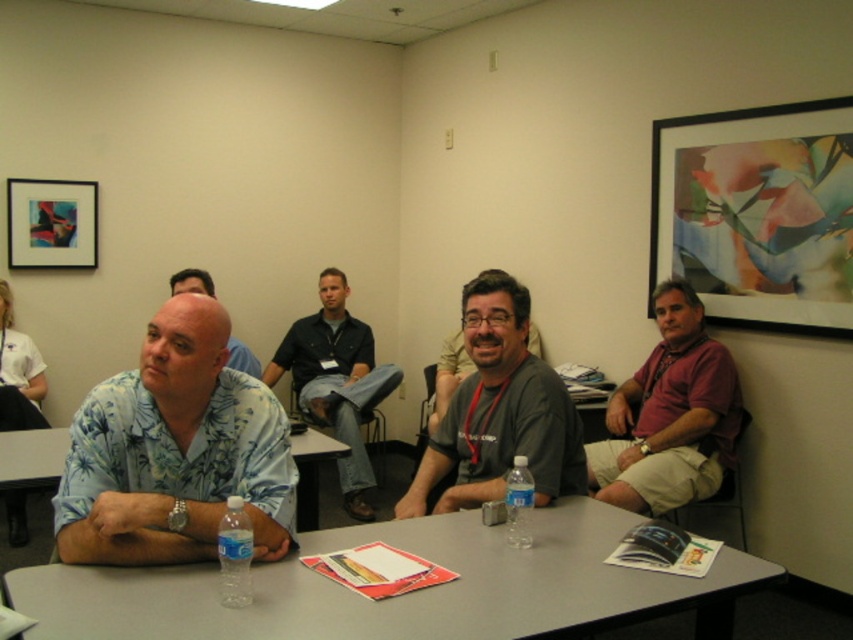
You are standing in the conference room and want to walk towards the two points marked in the image. Which point, point (16, 244) or point (45, 484), will you reach first?

You will reach point (16, 244) first because it is closer to you than point (45, 484), which is further away.

You are observing a group of people in a conference room. You notice the blue floral shirt at left and the gray fabric shirt at center. Which of these two shirts is positioned lower in the image?

The blue floral shirt at left is positioned lower in the image because it is below the gray fabric shirt at center.

You are standing in the conference room and need to locate the maroon fabric shirt at center. According to the scene description, where would you find it?

The maroon fabric shirt at center is located at point (669, 416) in the image coordinates.